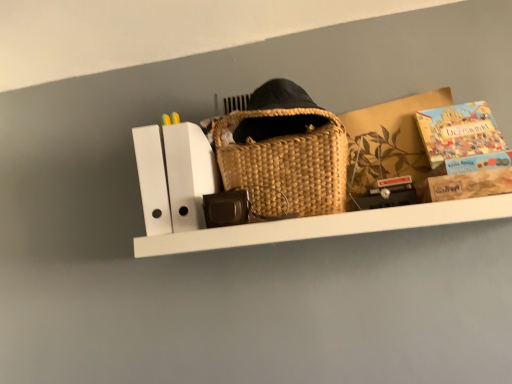
Question: Should I look upward or downward to see matte cardboard book at upper right?

Choices:
 (A) down
 (B) up

Answer: (B)

Question: Is brown cardboard box at upper right aimed at matte cardboard book at upper right?

Choices:
 (A) yes
 (B) no

Answer: (A)

Question: Is brown cardboard box at upper right next to matte cardboard book at upper right?

Choices:
 (A) no
 (B) yes

Answer: (A)

Question: Could matte cardboard book at upper right be considered to be inside brown cardboard box at upper right?

Choices:
 (A) no
 (B) yes

Answer: (B)

Question: From a real-world perspective, is brown cardboard box at upper right below matte cardboard book at upper right?

Choices:
 (A) yes
 (B) no

Answer: (A)

Question: Does brown cardboard box at upper right come in front of matte cardboard book at upper right?

Choices:
 (A) no
 (B) yes

Answer: (A)

Question: Can you confirm if brown cardboard box at upper right is positioned to the right of matte cardboard book at upper right?

Choices:
 (A) yes
 (B) no

Answer: (B)

Question: Is matte cardboard book at upper right taller than brown cardboard box at upper right?

Choices:
 (A) no
 (B) yes

Answer: (A)

Question: Considering the relative sizes of matte cardboard book at upper right and brown cardboard box at upper right in the image provided, is matte cardboard book at upper right shorter than brown cardboard box at upper right?

Choices:
 (A) no
 (B) yes

Answer: (B)

Question: Is matte cardboard book at upper right at the left side of brown cardboard box at upper right?

Choices:
 (A) yes
 (B) no

Answer: (B)

Question: Does matte cardboard book at upper right lie in front of brown cardboard box at upper right?

Choices:
 (A) yes
 (B) no

Answer: (A)

Question: Can you confirm if matte cardboard book at upper right is thinner than brown cardboard box at upper right?

Choices:
 (A) no
 (B) yes

Answer: (B)

Question: Does matte cardboard book at upper right touch brown cardboard box at upper right?

Choices:
 (A) yes
 (B) no

Answer: (B)

Question: Looking at the image, does brown cardboard box at upper right seem bigger or smaller compared to matte cardboard book at upper right?

Choices:
 (A) small
 (B) big

Answer: (B)